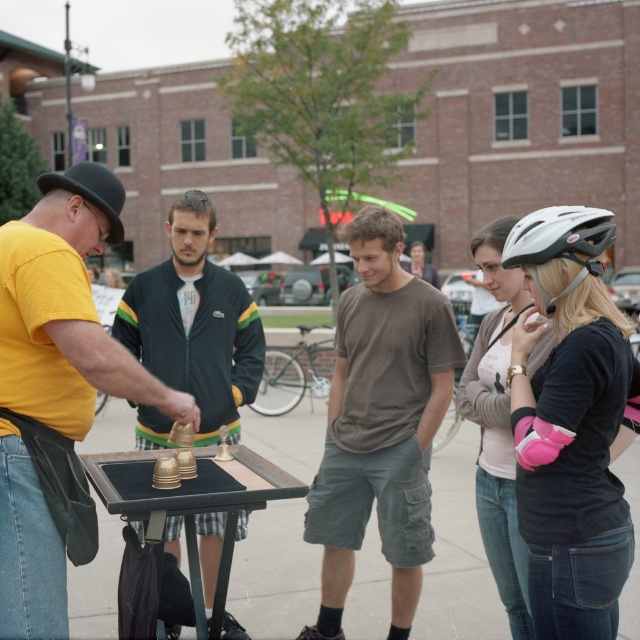
You are a tailor measuring clothing for a costume party. You have a limited amount of fabric. You need to decide which clothing item, the yellow matte shirt at left or the black jacket at center, requires less fabric to make. Based on the scene, which one would you choose?

The yellow matte shirt at left requires less fabric since its width is less than the black jacket at center.